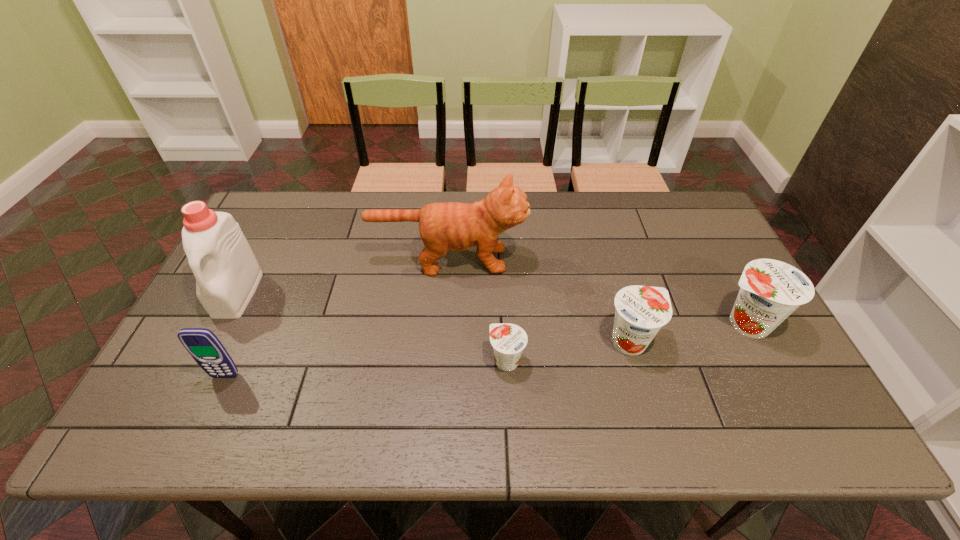
Where is `the leftmost yogurt`? This screenshot has height=540, width=960. the leftmost yogurt is located at coordinates (508, 340).

Image resolution: width=960 pixels, height=540 pixels. I want to click on the shortest object, so click(x=508, y=340).

Find the location of `the second yogurt from left to right`. the second yogurt from left to right is located at coordinates (641, 311).

This screenshot has height=540, width=960. What are the coordinates of `the second shortest object` in the screenshot? It's located at (641, 311).

What are the coordinates of `the rightmost yogurt` in the screenshot? It's located at (771, 290).

Image resolution: width=960 pixels, height=540 pixels. I want to click on detergent, so click(227, 273).

I want to click on cat, so click(x=450, y=226).

Where is `cellular telephone`? The height and width of the screenshot is (540, 960). cellular telephone is located at coordinates (202, 344).

Locate an element on the screen. Image resolution: width=960 pixels, height=540 pixels. free space located 0.170m on the left of the leftmost yogurt is located at coordinates (420, 361).

Where is `free point located on the back of the second yogurt from left to right`? The image size is (960, 540). free point located on the back of the second yogurt from left to right is located at coordinates pos(600,237).